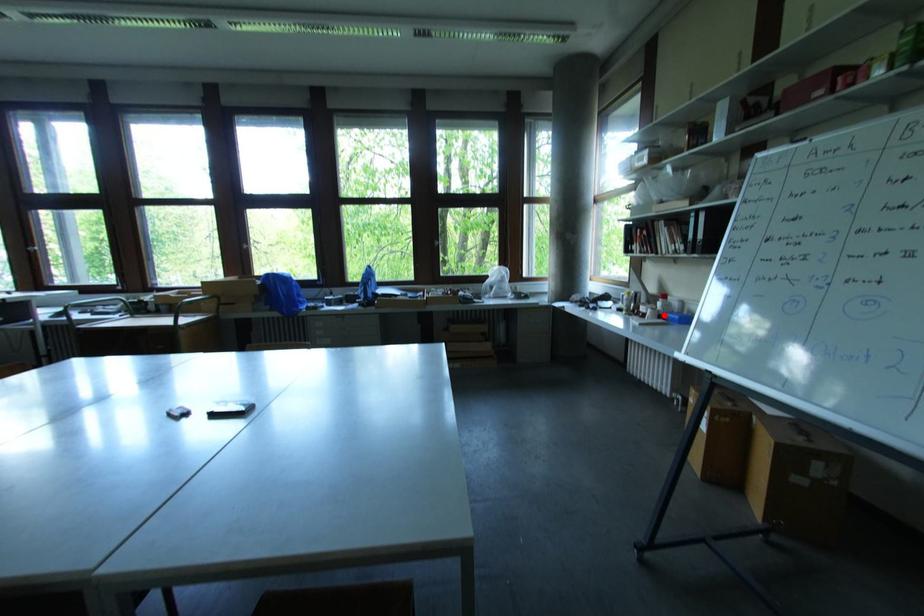
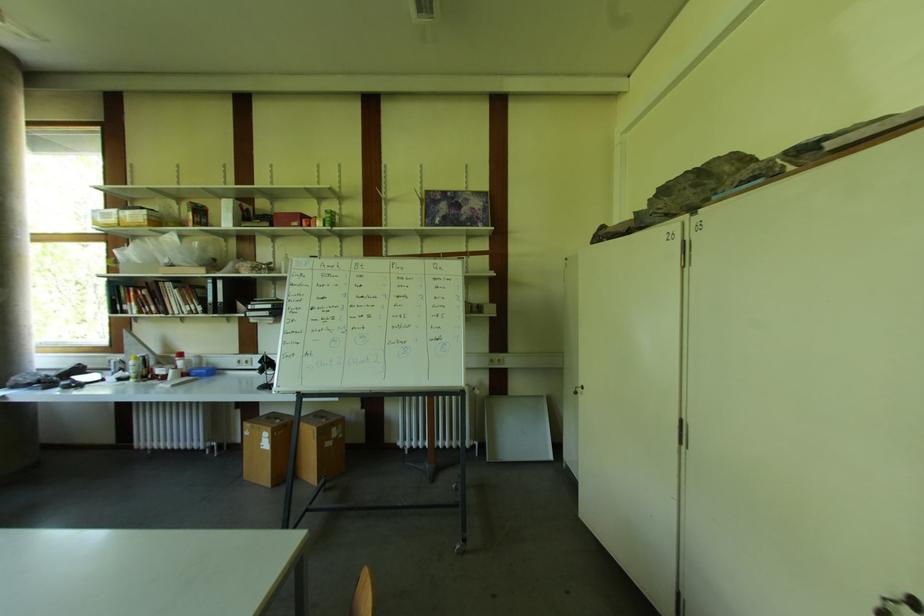
In the second image, find the point that corresponds to the highlighted location in the first image.

(188, 373)